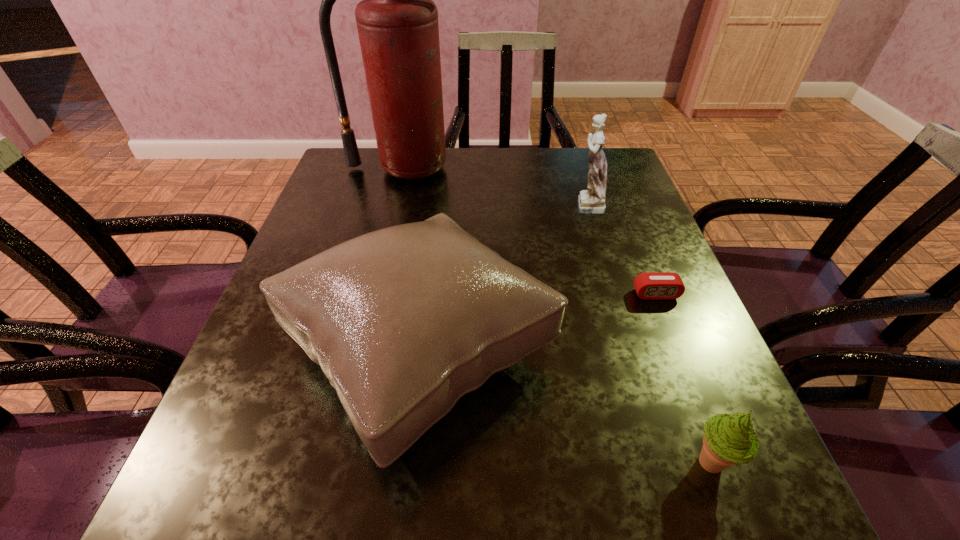
Locate an element on the screen. blank area located 0.090m on the right of the cushion is located at coordinates (606, 349).

What are the coordinates of `vacant region located on the back of the fourth tallest object` in the screenshot? It's located at (639, 272).

Locate an element on the screen. The image size is (960, 540). free region located on the front-facing side of the alarm clock is located at coordinates (714, 442).

I want to click on object situated at the far edge, so click(x=397, y=21).

Identify the location of cushion located in the near edge section of the desktop. The image size is (960, 540). (403, 321).

Locate an element on the screen. The height and width of the screenshot is (540, 960). icecream that is at the near edge is located at coordinates tap(728, 439).

Where is `fire extinguisher positioned at the left edge`? The image size is (960, 540). fire extinguisher positioned at the left edge is located at coordinates (397, 21).

Locate an element on the screen. The image size is (960, 540). cushion at the left edge is located at coordinates (403, 321).

Where is `figurine located in the right edge section of the desktop`? This screenshot has width=960, height=540. figurine located in the right edge section of the desktop is located at coordinates (591, 201).

The width and height of the screenshot is (960, 540). I want to click on icecream present at the right edge, so click(x=728, y=439).